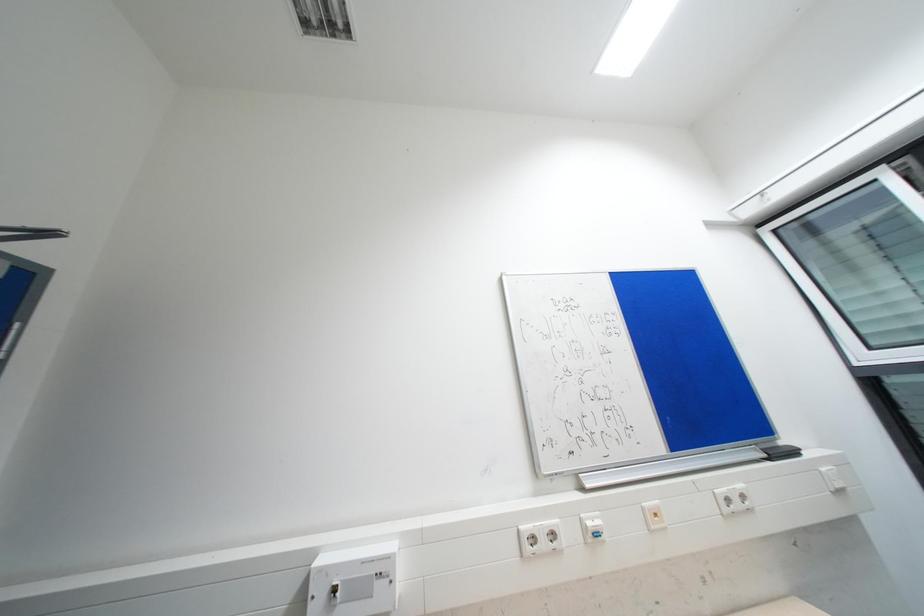
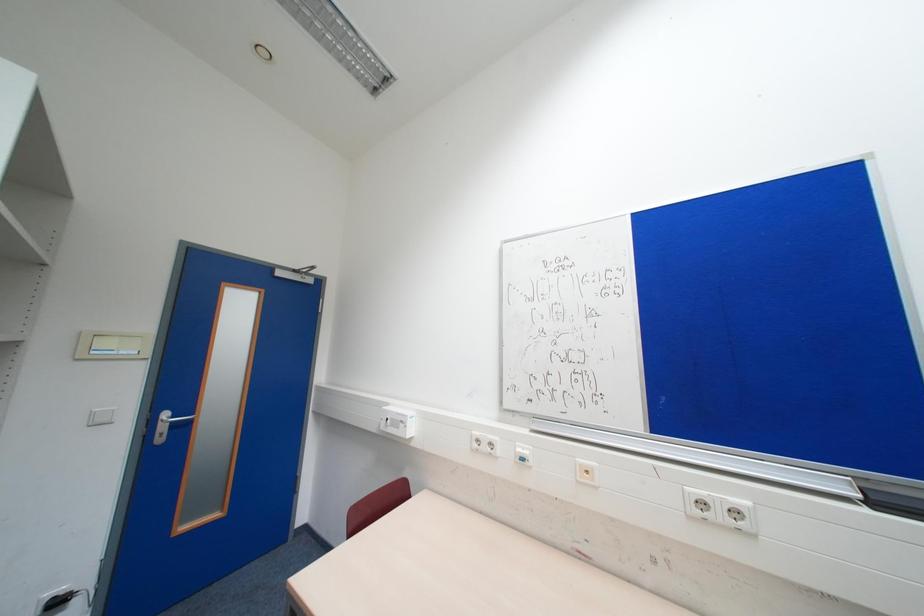
Question: The camera is either moving clockwise (left) or counter-clockwise (right) around the object. The first image is from the beginning of the video and the second image is from the end. Is the camera moving left or right when shooting the video?

Choices:
 (A) Left
 (B) Right

Answer: (B)